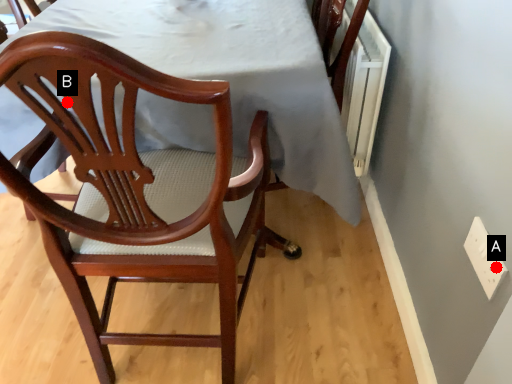
Question: Two points are circled on the image, labeled by A and B beside each circle. Which point is closer to the camera?

Choices:
 (A) A is closer
 (B) B is closer

Answer: (B)